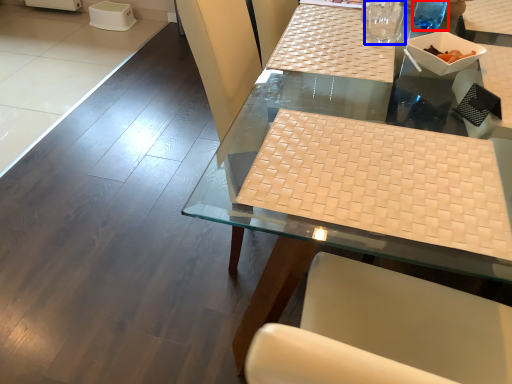
Question: Which point is closer to the camera, beverage (highlighted by a red box) or clear (highlighted by a blue box)?

Choices:
 (A) beverage
 (B) clear

Answer: (B)